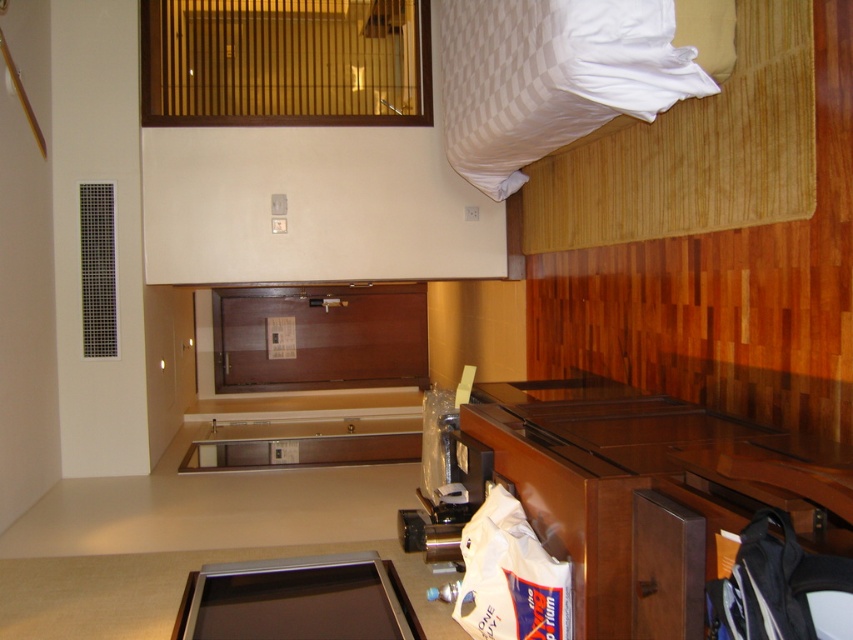
Question: Is white striped pillow at upper right bigger than metallic flat panel at lower center?

Choices:
 (A) no
 (B) yes

Answer: (B)

Question: Is white striped pillow at upper right to the right of metallic flat panel at lower center from the viewer's perspective?

Choices:
 (A) no
 (B) yes

Answer: (B)

Question: Which point is closer to the camera?

Choices:
 (A) (355, 634)
 (B) (579, 45)

Answer: (A)

Question: Is white striped pillow at upper right smaller than metallic flat panel at lower center?

Choices:
 (A) no
 (B) yes

Answer: (A)